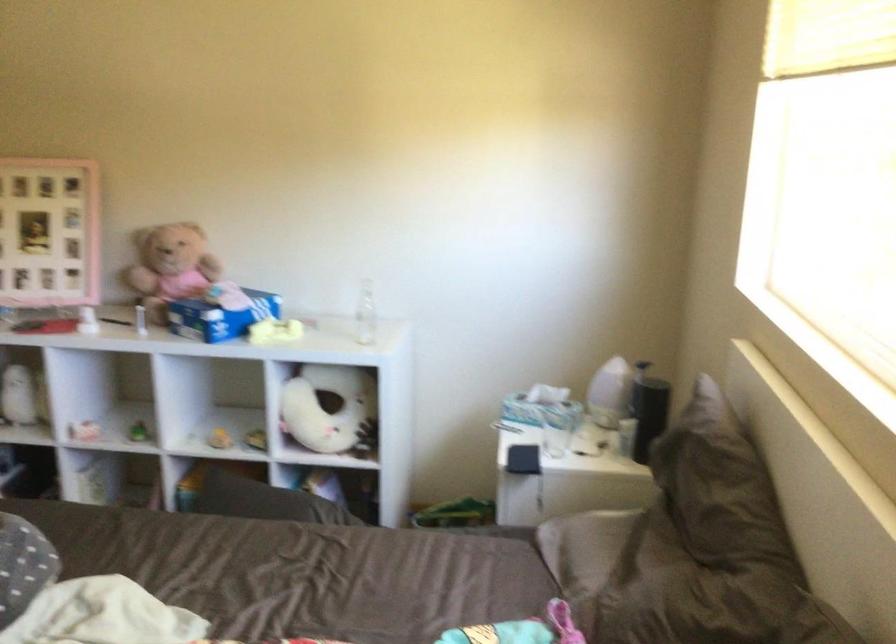
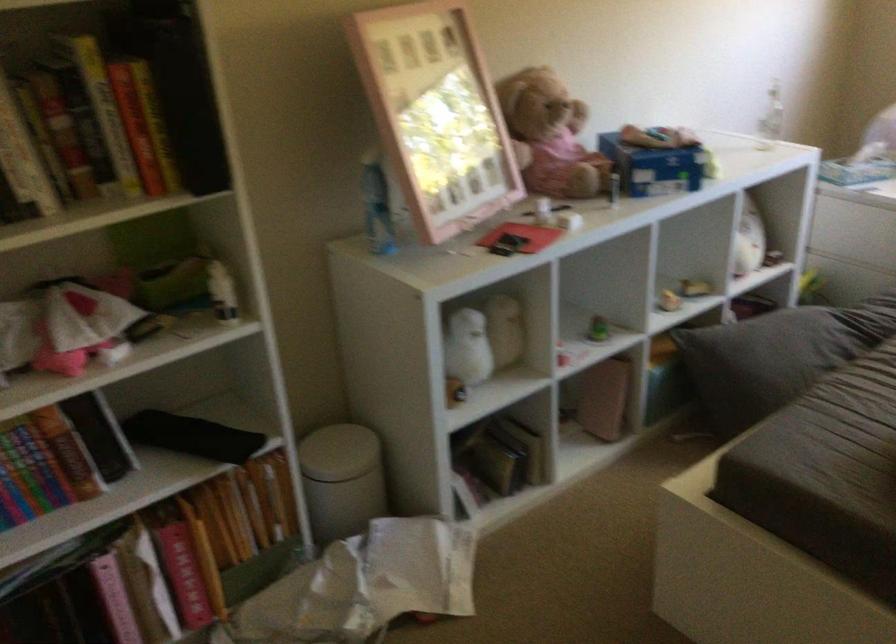
Locate, in the second image, the point that corresponds to point 218,514 in the first image.

(776, 357)